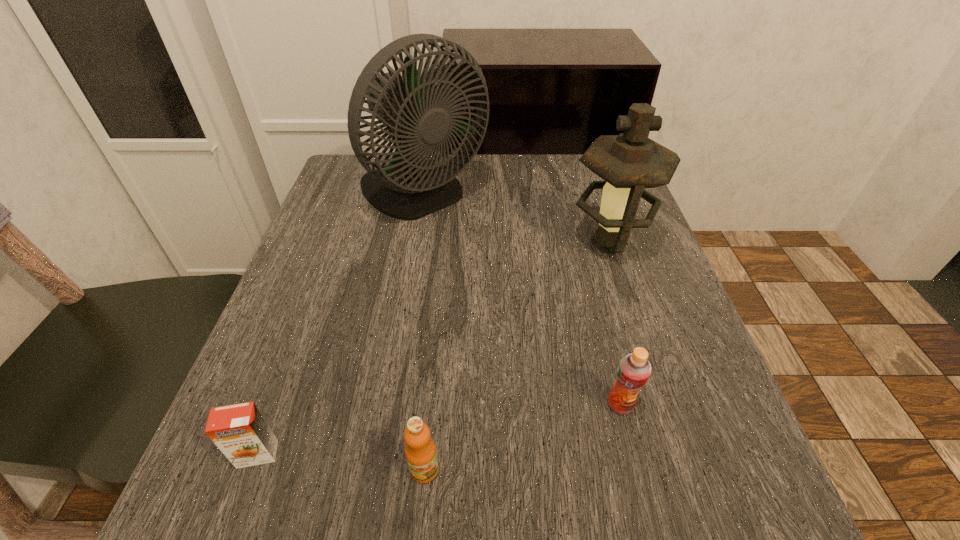
Identify the location of the tallest object. (419, 119).

Identify the location of oil lamp. (629, 162).

Image resolution: width=960 pixels, height=540 pixels. What are the coordinates of `the rightmost orange juice` in the screenshot? It's located at (633, 371).

Image resolution: width=960 pixels, height=540 pixels. I want to click on the third farthest object, so click(633, 371).

Locate an element on the screen. The height and width of the screenshot is (540, 960). the second orange juice from right to left is located at coordinates (420, 451).

This screenshot has width=960, height=540. Identify the location of the leftmost orange juice. (240, 431).

Find the location of a particular element. Image resolution: width=960 pixels, height=540 pixels. the shortest object is located at coordinates (240, 431).

What are the coordinates of `free spot located 0.190m in front of the tallest object to direct airflow` in the screenshot? It's located at (405, 300).

Locate an element on the screen. This screenshot has height=540, width=960. free space located on the front of the oil lamp is located at coordinates coord(645,355).

The width and height of the screenshot is (960, 540). I want to click on vacant region located 0.200m on the back of the rightmost orange juice, so click(x=593, y=298).